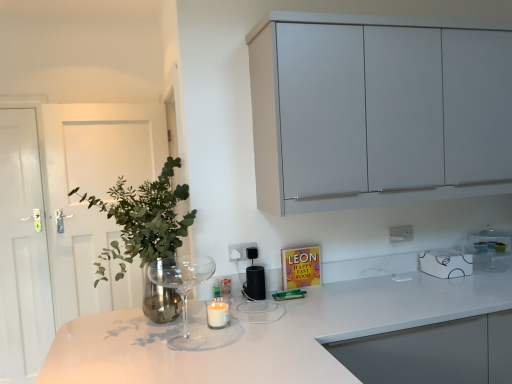
Question: Is white glossy countertop at center further to camera compared to white wooden door at left?

Choices:
 (A) no
 (B) yes

Answer: (A)

Question: Is white wooden door at left located within white glossy countertop at center?

Choices:
 (A) no
 (B) yes

Answer: (A)

Question: Can you confirm if white glossy countertop at center is shorter than white wooden door at left?

Choices:
 (A) no
 (B) yes

Answer: (B)

Question: From a real-world perspective, is white glossy countertop at center positioned under white wooden door at left based on gravity?

Choices:
 (A) yes
 (B) no

Answer: (A)

Question: Could you tell me if white glossy countertop at center is turned towards white wooden door at left?

Choices:
 (A) no
 (B) yes

Answer: (A)

Question: Is point (407, 228) positioned closer to the camera than point (485, 256)?

Choices:
 (A) closer
 (B) farther

Answer: (B)

Question: From the image's perspective, is white plastic electric outlet at upper center, which appears as the second electric outlet when viewed from the front, positioned above or below white glossy microwave at upper right, acting as the third appliance starting from the left?

Choices:
 (A) above
 (B) below

Answer: (A)

Question: Considering the positions of white plastic electric outlet at upper center, which appears as the 1th electric outlet when viewed from the back, and white glossy microwave at upper right, which ranks as the first appliance in right-to-left order, in the image, is white plastic electric outlet at upper center, which appears as the 1th electric outlet when viewed from the back, wider or thinner than white glossy microwave at upper right, which ranks as the first appliance in right-to-left order,?

Choices:
 (A) thin
 (B) wide

Answer: (A)

Question: Visually, is white plastic electric outlet at upper center, arranged as the second electric outlet when viewed from the left, positioned to the left or to the right of white glossy microwave at upper right, acting as the third appliance starting from the left?

Choices:
 (A) right
 (B) left

Answer: (B)

Question: Do you think white wooden door at left is within white glossy door at left, or outside of it?

Choices:
 (A) outside
 (B) inside

Answer: (A)

Question: Is point (68, 125) closer or farther from the camera than point (25, 205)?

Choices:
 (A) farther
 (B) closer

Answer: (B)

Question: From the image's perspective, is white wooden door at left above or below white glossy door at left?

Choices:
 (A) below
 (B) above

Answer: (B)

Question: In the image, is white wooden door at left positioned in front of or behind white glossy door at left?

Choices:
 (A) behind
 (B) front

Answer: (B)

Question: Is white glossy coffee cup at upper right, positioned as the 2th appliance in left-to-right order, wider or thinner than white glossy microwave at upper right, which ranks as the first appliance in right-to-left order?

Choices:
 (A) thin
 (B) wide

Answer: (A)

Question: From their relative heights in the image, would you say white glossy coffee cup at upper right, positioned as the second appliance in right-to-left order, is taller or shorter than white glossy microwave at upper right, acting as the third appliance starting from the left?

Choices:
 (A) tall
 (B) short

Answer: (B)